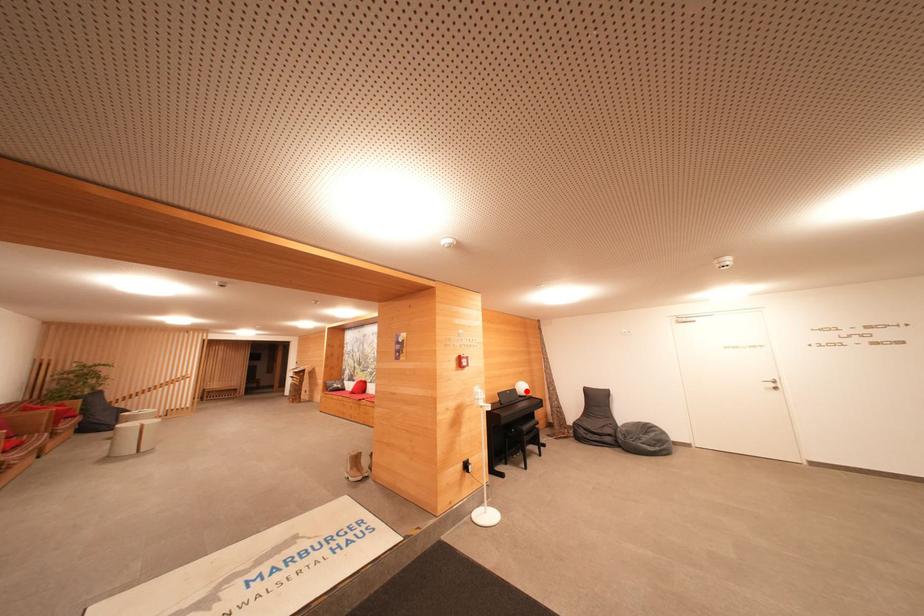
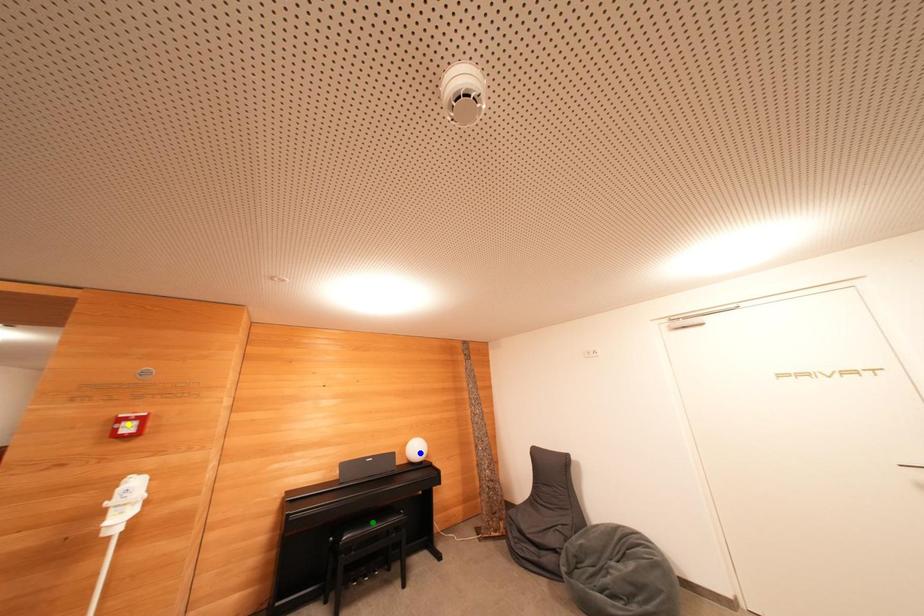
Question: I am providing you with two images of the same scene from different viewpoints. A red point is marked on the first image. You are given multiple points on the second image. Which spot in image 2 lines up with the point in image 1?

Choices:
 (A) green point
 (B) yellow point
 (C) blue point

Answer: (C)